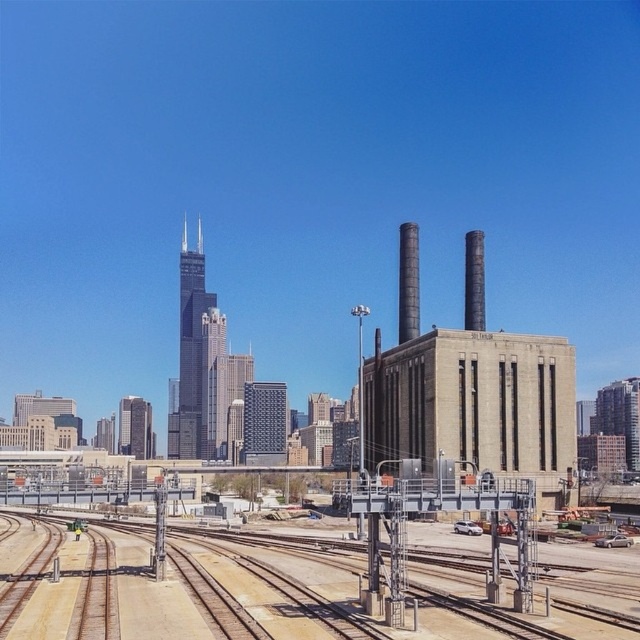
Question: Does brown wooden track at lower center appear on the left side of metallic gray power station at center?

Choices:
 (A) yes
 (B) no

Answer: (A)

Question: Can you confirm if brown wooden track at lower center is bigger than metallic gray power station at center?

Choices:
 (A) no
 (B) yes

Answer: (B)

Question: Does brown wooden track at lower center come in front of metallic gray power station at center?

Choices:
 (A) no
 (B) yes

Answer: (B)

Question: Which point appears closest to the camera in this image?

Choices:
 (A) (513, 483)
 (B) (116, 611)

Answer: (B)

Question: Which object appears closest to the camera in this image?

Choices:
 (A) brown wooden track at lower center
 (B) metallic gray power station at center

Answer: (A)